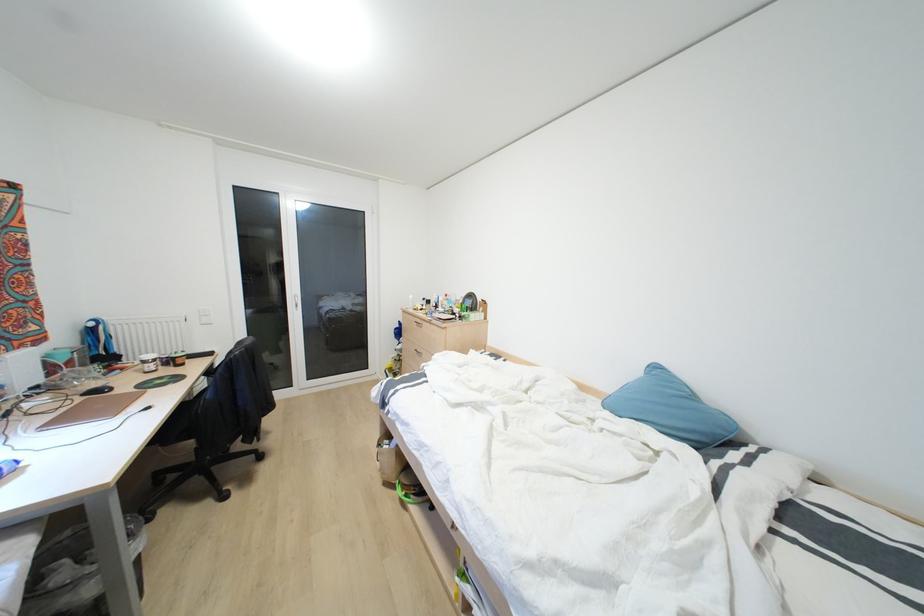
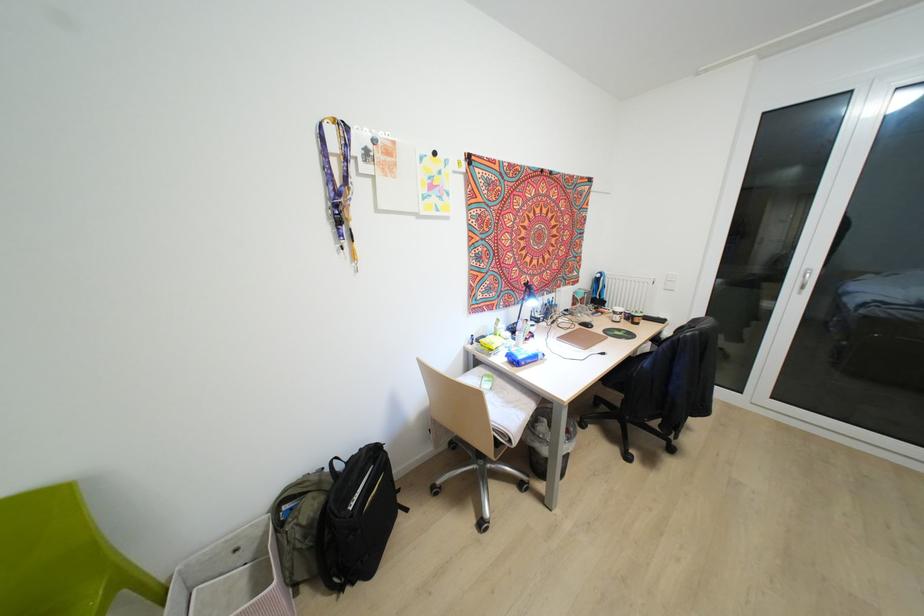
In the second image, find the point that corresponds to point (190, 458) in the first image.

(617, 405)